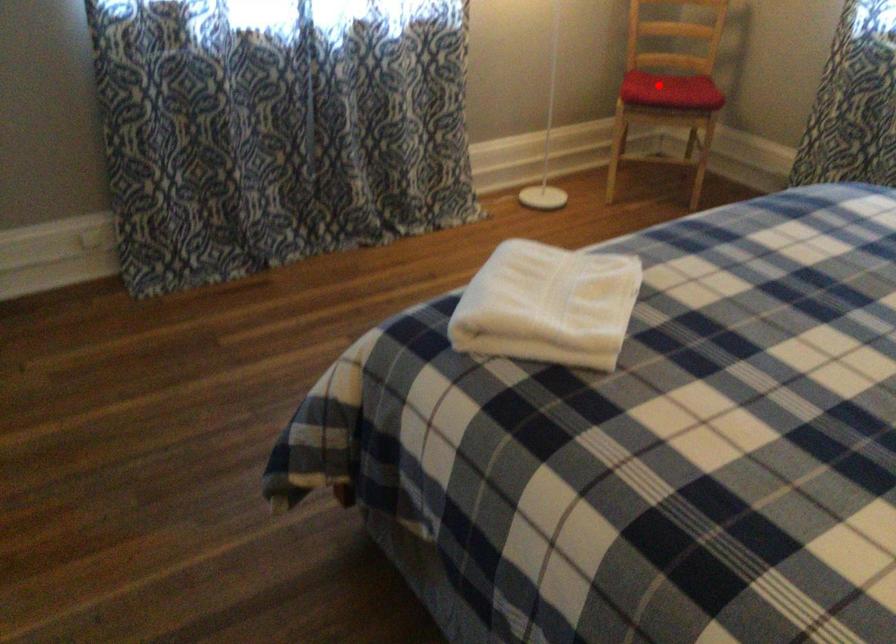
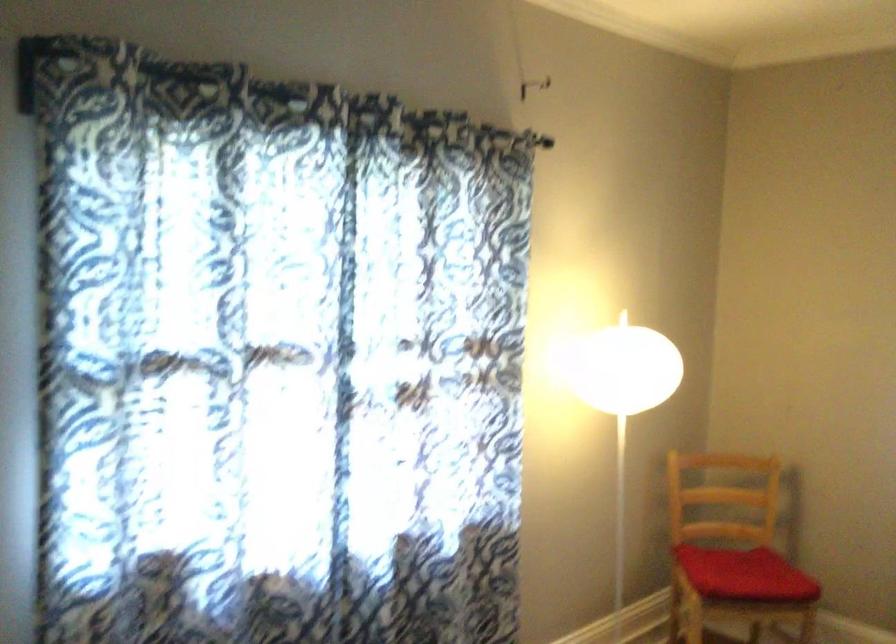
Question: A red point is marked in image1. In image2, is the corresponding 3D point closer to the camera or farther? Reply with the corresponding letter.

Choices:
 (A) The corresponding 3D point is closer.
 (B) The corresponding 3D point is farther.

Answer: (A)